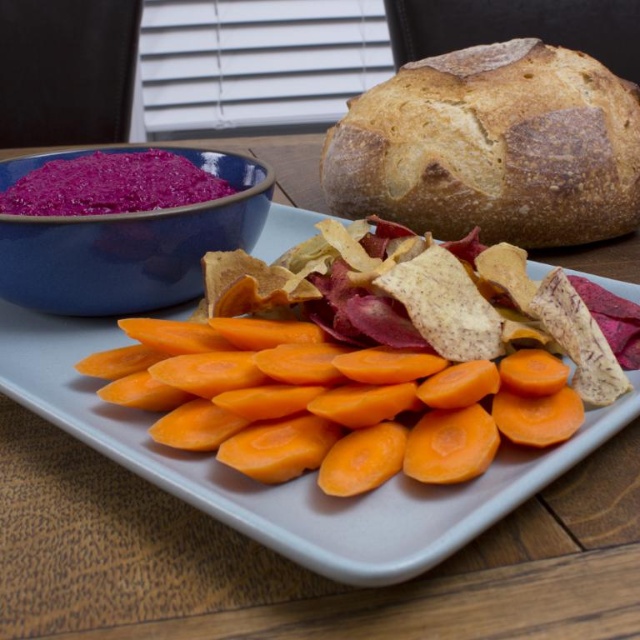
You are arranging a picnic basket and need to know the spatial relationship between the golden brown crusty loaf at upper right and the orange smooth carrot at center. Which item is positioned to the right of the other?

The golden brown crusty loaf at upper right is positioned to the right of the orange smooth carrot at center.

You are a food photographer trying to capture the rustic bread in the scene. Given that the golden brown crusty loaf at upper right is represented by point (492, 147), where should you position your camera to ensure the rustic bread is centered in your shot?

The golden brown crusty loaf at upper right is represented by point (492, 147), so you should position your camera directly facing that coordinate to center the rustic bread in your shot.

From the picture: You are a food stylist arranging a photo shoot setup. You need to place a 4.5 inch wide decorative plate between the orange smooth carrot at center and the purple matte bowl at upper left. Will there be enough space between them to fit the plate without overlapping?

The distance between the orange smooth carrot at center and the purple matte bowl at upper left is 4.26 inches. Since the decorative plate is 4.5 inches wide, it is slightly wider than the available space. Therefore, the plate will not fit without overlapping the carrot or the bowl.